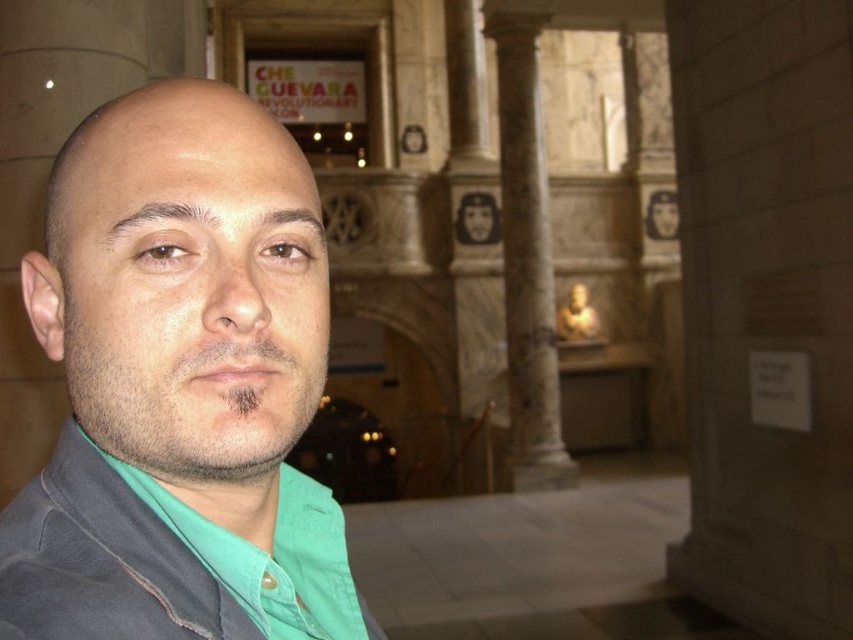
Question: Estimate the real-world distances between objects in this image. Which object is farther from the marble column at center?

Choices:
 (A) dark gray matte jacket at center
 (B) gray matte jacket at left

Answer: (A)

Question: Which object is farther from the camera taking this photo?

Choices:
 (A) dark gray matte jacket at center
 (B) gray matte jacket at left
 (C) marble column at center

Answer: (C)

Question: Can you confirm if gray matte jacket at left is positioned to the left of dark gray matte jacket at center?

Choices:
 (A) no
 (B) yes

Answer: (A)

Question: Which of the following is the closest to the observer?

Choices:
 (A) (292, 509)
 (B) (16, 500)

Answer: (B)

Question: Is marble column at center thinner than dark gray matte jacket at center?

Choices:
 (A) no
 (B) yes

Answer: (B)

Question: Does gray matte jacket at left have a lesser width compared to dark gray matte jacket at center?

Choices:
 (A) no
 (B) yes

Answer: (A)